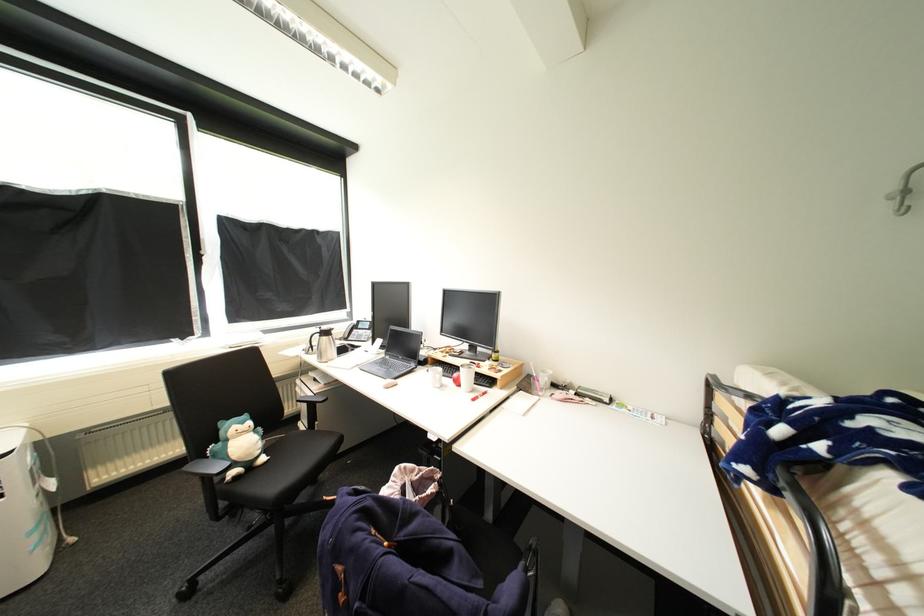
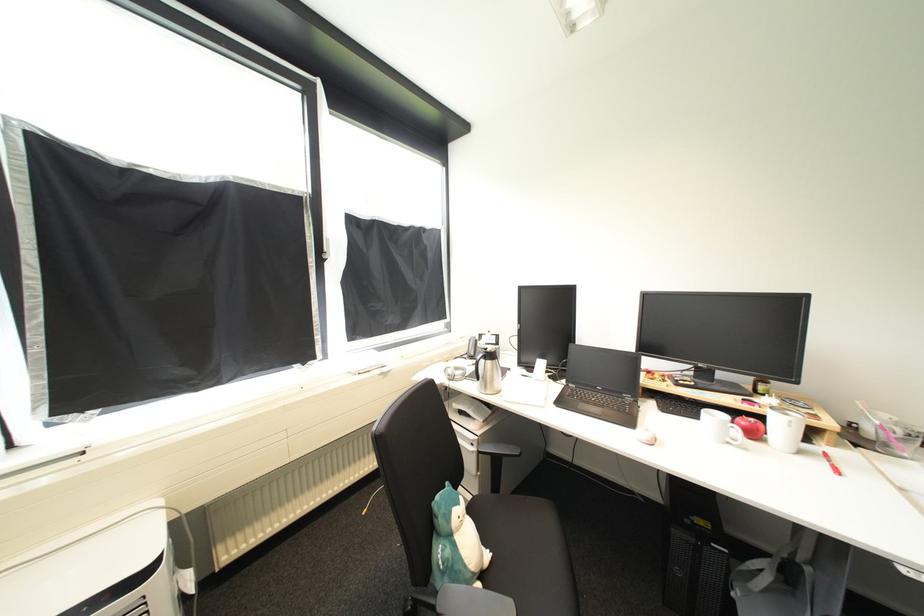
In the second image, find the point that corresponds to point 367,330 in the first image.

(492, 345)